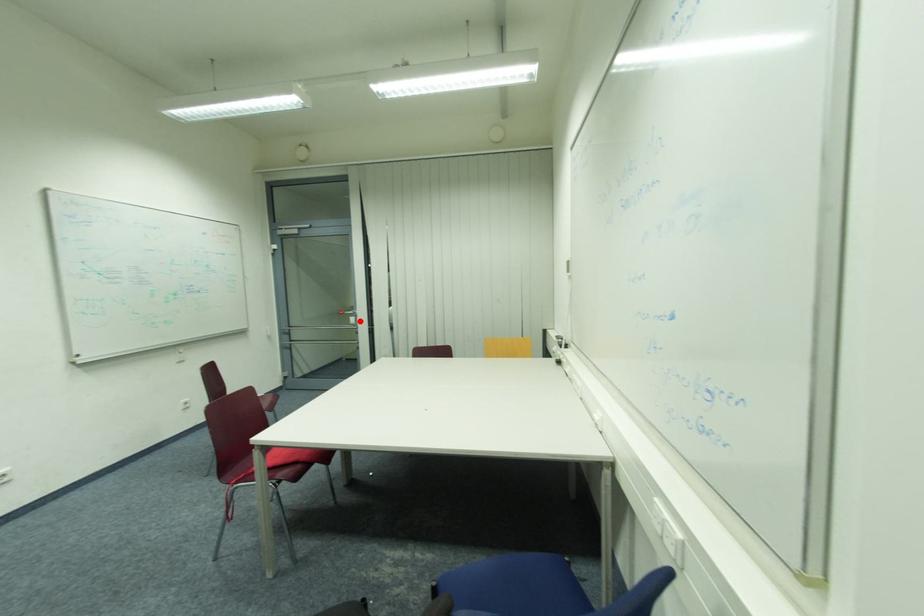
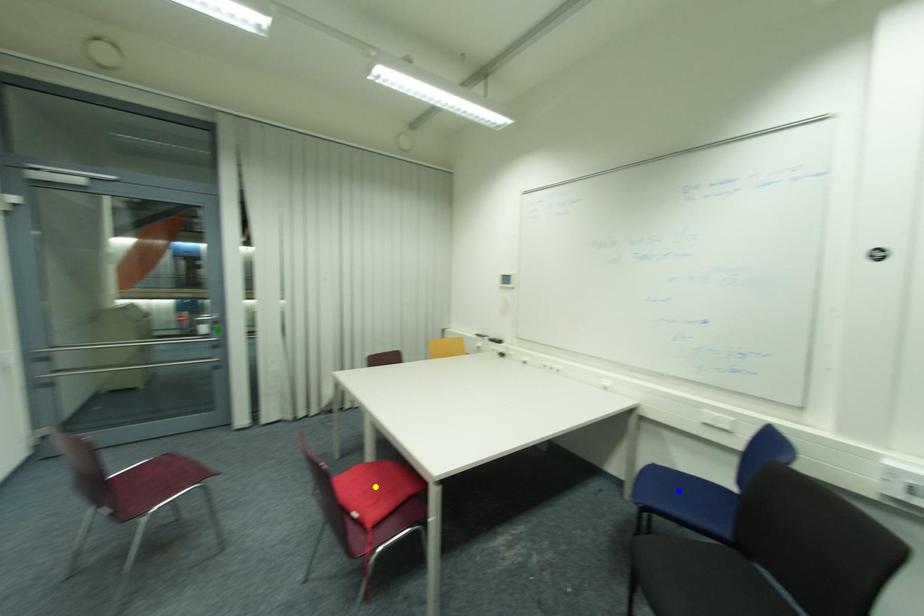
Question: I am providing you with two images of the same scene from different viewpoints. A red point is marked on the first image. You are given multiple points on the second image. Can you choose the point in image 2 that corresponds to the point in image 1?

Choices:
 (A) yellow point
 (B) green point
 (C) blue point

Answer: (B)